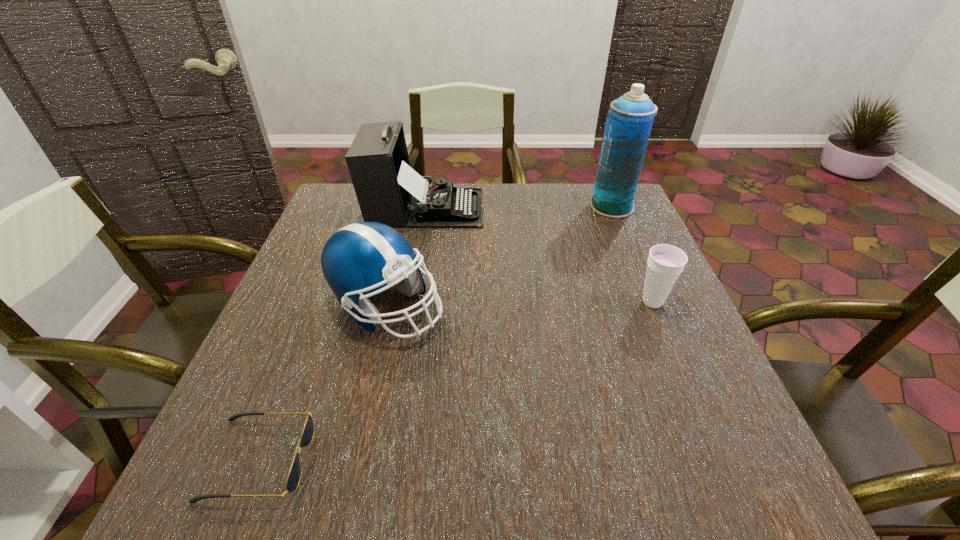
Where is `aerosol can`? The image size is (960, 540). aerosol can is located at coordinates (629, 120).

Where is `typewriter`? The image size is (960, 540). typewriter is located at coordinates (388, 190).

Image resolution: width=960 pixels, height=540 pixels. What are the coordinates of `football helmet` in the screenshot? It's located at (360, 258).

Identify the location of the second shortest object. Image resolution: width=960 pixels, height=540 pixels. (665, 263).

Locate an element on the screen. The image size is (960, 540). the shortest object is located at coordinates (293, 479).

Where is `the nearest object`? the nearest object is located at coordinates (293, 479).

Identify the location of vacant position located on the front of the tallest object. The image size is (960, 540). (653, 305).

Where is `free spot located 0.310m inside the open case of the fourth shortest object`? free spot located 0.310m inside the open case of the fourth shortest object is located at coordinates (591, 208).

Identify the location of vacant space located at the front of the third tallest object with the faceguard. click(554, 307).

Where is `vacant space located 0.240m on the front of the cup`? vacant space located 0.240m on the front of the cup is located at coordinates (699, 413).